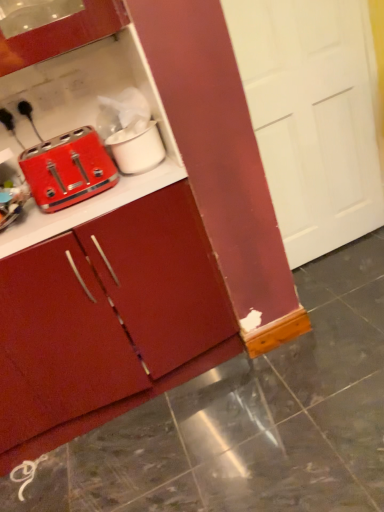
Locate an element on the screen. The height and width of the screenshot is (512, 384). free location to the right of white glossy tile at lower left is located at coordinates (71, 467).